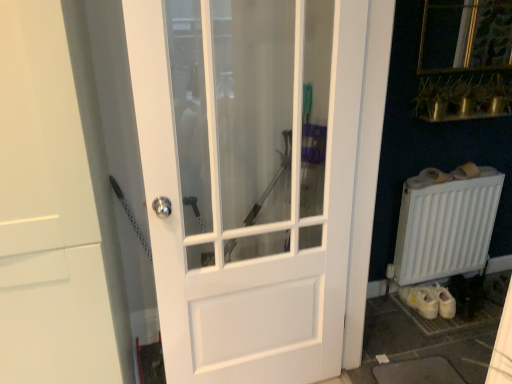
Question: Which direction should I rotate to look at white glossy door at center, which appears as the first door when viewed from the right?

Choices:
 (A) right
 (B) left

Answer: (B)

Question: Does white matte radiator at lower right lie in front of white glossy door at center, which is the 2th door in right-to-left order?

Choices:
 (A) yes
 (B) no

Answer: (B)

Question: Does white matte radiator at lower right have a lesser height compared to white glossy door at center, the first door when ordered from left to right?

Choices:
 (A) yes
 (B) no

Answer: (A)

Question: Does white matte radiator at lower right contain white glossy door at center, which is the 2th door in right-to-left order?

Choices:
 (A) yes
 (B) no

Answer: (B)

Question: Does white matte radiator at lower right appear on the right side of white glossy door at center, which is the 2th door in right-to-left order?

Choices:
 (A) no
 (B) yes

Answer: (B)

Question: From the image's perspective, is white matte radiator at lower right on white glossy door at center, which is the 2th door in right-to-left order?

Choices:
 (A) yes
 (B) no

Answer: (B)

Question: From a real-world perspective, is white matte radiator at lower right on white glossy door at center, the first door when ordered from left to right?

Choices:
 (A) yes
 (B) no

Answer: (B)

Question: Considering the relative positions of white glossy door at center, the first door when ordered from left to right, and white matte radiator at lower right in the image provided, is white glossy door at center, the first door when ordered from left to right, in front of white matte radiator at lower right?

Choices:
 (A) yes
 (B) no

Answer: (A)

Question: Can you confirm if white glossy door at center, which is the 2th door in right-to-left order, is taller than white matte radiator at lower right?

Choices:
 (A) no
 (B) yes

Answer: (B)

Question: Considering the relative sizes of white glossy door at center, which is the 2th door in right-to-left order, and white matte radiator at lower right in the image provided, is white glossy door at center, which is the 2th door in right-to-left order, bigger than white matte radiator at lower right?

Choices:
 (A) no
 (B) yes

Answer: (B)

Question: Can you confirm if white glossy door at center, the first door when ordered from left to right, is shorter than white matte radiator at lower right?

Choices:
 (A) no
 (B) yes

Answer: (A)

Question: Does white glossy door at center, which is the 2th door in right-to-left order, appear on the left side of white matte radiator at lower right?

Choices:
 (A) no
 (B) yes

Answer: (B)

Question: From a real-world perspective, is white glossy door at center, the first door when ordered from left to right, under white matte radiator at lower right?

Choices:
 (A) no
 (B) yes

Answer: (A)

Question: Can you confirm if white glossy door at center, which appears as the first door when viewed from the right, is taller than white glossy door at center, which is the 2th door in right-to-left order?

Choices:
 (A) yes
 (B) no

Answer: (B)